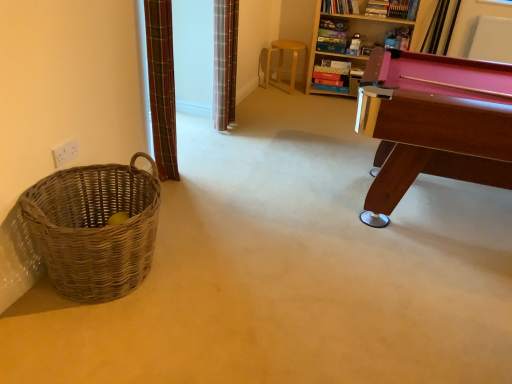
Identify the location of plaid fabric curtain at upper center, the first curtain positioned from the back. This screenshot has width=512, height=384. (225, 61).

Identify the location of pink wood pool table at right. (433, 124).

The width and height of the screenshot is (512, 384). What do you see at coordinates (95, 228) in the screenshot? I see `woven brown basket at left` at bounding box center [95, 228].

This screenshot has width=512, height=384. What are the coordinates of `wooden bookcase at upper right` in the screenshot? It's located at (362, 39).

The height and width of the screenshot is (384, 512). In order to click on plaid fabric curtain at upper center, which ranks as the 2th curtain in front-to-back order in this screenshot , I will do `click(225, 61)`.

Is the surface of wooden bookcase at upper right in direct contact with pink wood pool table at right?

No, wooden bookcase at upper right is not touching pink wood pool table at right.

Can you confirm if wooden bookcase at upper right is shorter than pink wood pool table at right?

No.

Does point (318, 53) come behind point (499, 74)?

That is True.

From the image's perspective, is plaid fabric curtain at left, the first curtain from the front, located above pink wood pool table at right?

Yes, from the image's perspective, plaid fabric curtain at left, the first curtain from the front, is above pink wood pool table at right.

Which of these two, plaid fabric curtain at left, which is the 2th curtain from back to front, or pink wood pool table at right, is thinner?

With smaller width is plaid fabric curtain at left, which is the 2th curtain from back to front.

Which object is closer to the camera, plaid fabric curtain at left, acting as the second curtain starting from the right, or pink wood pool table at right?

Positioned in front is pink wood pool table at right.

Is pink wood pool table at right spatially inside plaid fabric curtain at left, the first curtain positioned from the left, or outside of it?

pink wood pool table at right cannot be found inside plaid fabric curtain at left, the first curtain positioned from the left.

Is pink wood pool table at right positioned far away from plaid fabric curtain at left, the first curtain positioned from the left?

Yes, pink wood pool table at right and plaid fabric curtain at left, the first curtain positioned from the left, are located far from each other.

From a real-world perspective, who is located lower, pink wood pool table at right or plaid fabric curtain at left, acting as the second curtain starting from the right?

pink wood pool table at right is physically lower.

Is point (318, 92) positioned in front of point (216, 84)?

No, it is behind (216, 84).

Image resolution: width=512 pixels, height=384 pixels. In order to click on curtain that is under the wooden bookcase at upper right (from a real-world perspective) in this screenshot , I will do `click(225, 61)`.

Who is taller, wooden bookcase at upper right or plaid fabric curtain at upper center, the first curtain positioned from the back?

wooden bookcase at upper right is taller.

Is wooden bookcase at upper right facing towards plaid fabric curtain at upper center, arranged as the second curtain when viewed from the left?

Yes, wooden bookcase at upper right faces towards plaid fabric curtain at upper center, arranged as the second curtain when viewed from the left.

In the scene shown: From a real-world perspective, is pink wood pool table at right positioned under light brown wooden stool at center based on gravity?

No, from a real-world perspective, pink wood pool table at right is not beneath light brown wooden stool at center.

From the image's perspective, is pink wood pool table at right on top of light brown wooden stool at center?

No, from the image's perspective, pink wood pool table at right is not over light brown wooden stool at center.

Based on the photo, is wooden bookcase at upper right smaller than light brown wooden stool at center?

No, wooden bookcase at upper right is not smaller than light brown wooden stool at center.

In the scene shown: Who is taller, wooden bookcase at upper right or light brown wooden stool at center?

wooden bookcase at upper right is taller.

In the scene shown: Does wooden bookcase at upper right touch light brown wooden stool at center?

No, wooden bookcase at upper right is not making contact with light brown wooden stool at center.

How different are the orientations of wooden bookcase at upper right and light brown wooden stool at center in degrees?

The angle between the facing direction of wooden bookcase at upper right and the facing direction of light brown wooden stool at center is 0.928 degrees.

Considering the positions of objects pink wood pool table at right and plaid fabric curtain at upper center, arranged as the second curtain when viewed from the left, in the image provided, who is more to the right, pink wood pool table at right or plaid fabric curtain at upper center, arranged as the second curtain when viewed from the left,?

pink wood pool table at right is more to the right.

What's the angular difference between pink wood pool table at right and plaid fabric curtain at upper center, which ranks as the 2th curtain in front-to-back order,'s facing directions?

88.1 degrees.

In terms of size, does pink wood pool table at right appear bigger or smaller than plaid fabric curtain at upper center, arranged as the second curtain when viewed from the left?

In the image, pink wood pool table at right appears to be larger than plaid fabric curtain at upper center, arranged as the second curtain when viewed from the left.

The width and height of the screenshot is (512, 384). What are the coordinates of `bookcase that appears above the pink wood pool table at right (from a real-world perspective)` in the screenshot? It's located at pyautogui.click(x=362, y=39).

Starting from the pink wood pool table at right, which curtain is the 2nd one to the left? Please provide its 2D coordinates.

[(162, 86)]

Based on the photo, considering their positions, is light brown wooden stool at center positioned closer to woven brown basket at left than wooden bookcase at upper right?

Based on the image, light brown wooden stool at center appears to be nearer to woven brown basket at left.

Based on their spatial positions, is woven brown basket at left or pink wood pool table at right further from plaid fabric curtain at upper center, arranged as the second curtain when viewed from the left?

woven brown basket at left is positioned further to the anchor plaid fabric curtain at upper center, arranged as the second curtain when viewed from the left.

Looking at the image, which one is located further to wooden bookcase at upper right, woven brown basket at left or plaid fabric curtain at left, the first curtain positioned from the left?

woven brown basket at left.

Based on the photo, looking at the image, which one is located closer to woven brown basket at left, pink wood pool table at right or wooden bookcase at upper right?

pink wood pool table at right is closer to woven brown basket at left.

From the picture: Looking at the image, which one is located closer to light brown wooden stool at center, woven brown basket at left or plaid fabric curtain at upper center, arranged as the second curtain when viewed from the left?

plaid fabric curtain at upper center, arranged as the second curtain when viewed from the left, lies closer to light brown wooden stool at center than the other object.

When comparing their distances from plaid fabric curtain at left, acting as the second curtain starting from the right, does light brown wooden stool at center or pink wood pool table at right seem closer?

pink wood pool table at right lies closer to plaid fabric curtain at left, acting as the second curtain starting from the right, than the other object.

Considering their positions, is pink wood pool table at right positioned further to wooden bookcase at upper right than plaid fabric curtain at upper center, which ranks as the first curtain in right-to-left order?

pink wood pool table at right lies further to wooden bookcase at upper right than the other object.

Looking at this image, from the image, which object appears to be farther from wooden bookcase at upper right, light brown wooden stool at center or pink wood pool table at right?

pink wood pool table at right is further to wooden bookcase at upper right.

Find the location of a particular element. The image size is (512, 384). table located between woven brown basket at left and light brown wooden stool at center in the depth direction is located at coordinates (433, 124).

Where is `bookcase between woven brown basket at left and light brown wooden stool at center from front to back`? bookcase between woven brown basket at left and light brown wooden stool at center from front to back is located at coordinates (362, 39).

You are a GUI agent. You are given a task and a screenshot of the screen. Output one action in this format:
    pyautogui.click(x=<x>, y=<y>)
    Task: Click on the curtain between plaid fabric curtain at left, which is the 2th curtain from back to front, and light brown wooden stool at center, along the z-axis
    
    Given the screenshot: What is the action you would take?
    pyautogui.click(x=225, y=61)

This screenshot has height=384, width=512. I want to click on curtain between plaid fabric curtain at left, which is the 2th curtain from back to front, and pink wood pool table at right from left to right, so pos(225,61).